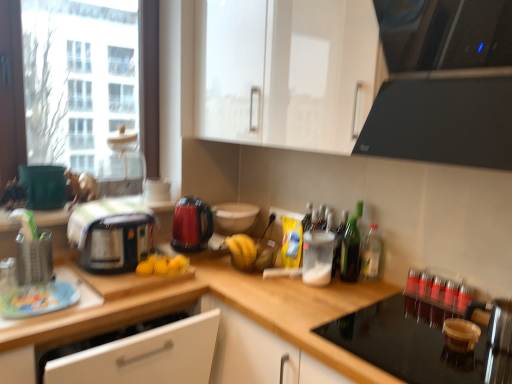
I want to click on free space in front of translucent plastic container at center, the second appliance in the right-to-left sequence, so click(x=312, y=297).